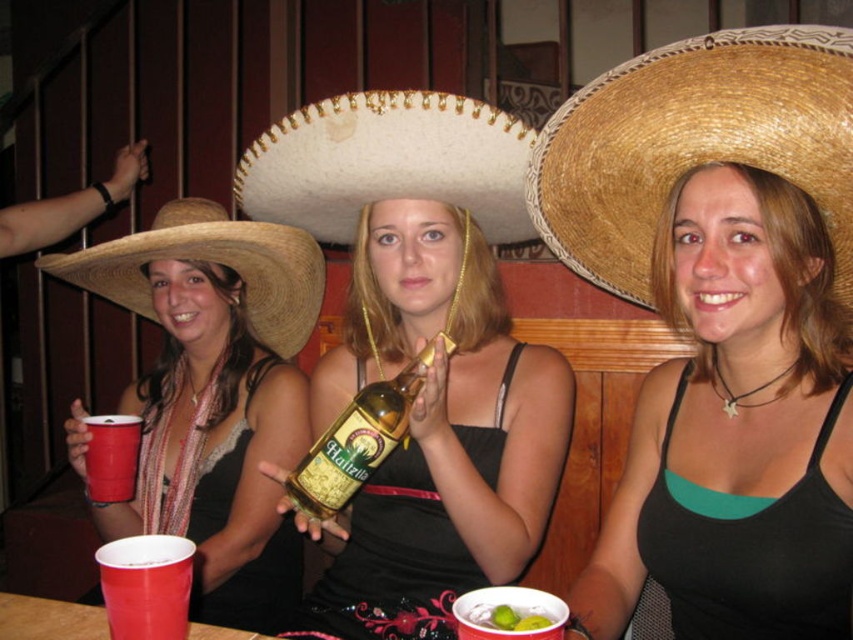
Can you confirm if matte straw sombrero at upper left is positioned above gold metallic bottle at center?

Actually, matte straw sombrero at upper left is below gold metallic bottle at center.

Can you confirm if matte straw sombrero at upper left is bigger than gold metallic bottle at center?

Indeed, matte straw sombrero at upper left has a larger size compared to gold metallic bottle at center.

Is point (149, 508) behind point (383, 396)?

Yes, point (149, 508) is behind point (383, 396).

This screenshot has height=640, width=853. Identify the location of matte straw sombrero at upper left. click(215, 396).

Does black matte tank top at center have a larger size compared to straw woven sombrero at right?

Yes, black matte tank top at center is bigger than straw woven sombrero at right.

Who is taller, black matte tank top at center or straw woven sombrero at right?

With more height is black matte tank top at center.

Is point (675, 381) in front of point (755, 64)?

No, it is not.

Locate an element on the screen. black matte tank top at center is located at coordinates (735, 429).

Can you confirm if white straw hat at center is positioned to the right of strawmaterial/texturecowboy hat at left?

Correct, you'll find white straw hat at center to the right of strawmaterial/texturecowboy hat at left.

Which of these two, white straw hat at center or strawmaterial/texturecowboy hat at left, stands shorter?

With less height is white straw hat at center.

Who is more forward, (x=459, y=140) or (x=314, y=320)?

Point (x=459, y=140) is in front.

Identify the location of white straw hat at center. This screenshot has width=853, height=640. (387, 163).